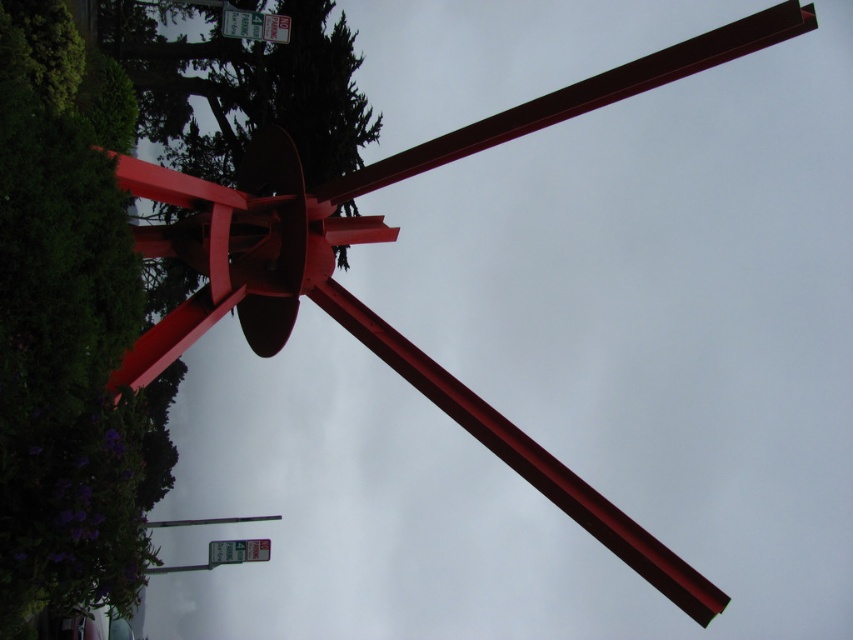
Question: Does white plastic sign at upper left have a larger size compared to metallic green street sign at lower center?

Choices:
 (A) no
 (B) yes

Answer: (B)

Question: Which point is closer to the camera taking this photo?

Choices:
 (A) (251, 541)
 (B) (109, 580)

Answer: (B)

Question: Is green leafy tree at upper left in front of white plastic sign at upper left?

Choices:
 (A) no
 (B) yes

Answer: (B)

Question: Which point is closer to the camera?

Choices:
 (A) green leafy tree at upper left
 (B) white plastic sign at upper left
 (C) metallic green street sign at lower center

Answer: (A)

Question: Based on their relative distances, which object is nearer to the white plastic sign at upper left?

Choices:
 (A) metallic green street sign at lower center
 (B) green leafy tree at upper left

Answer: (B)

Question: Is green leafy tree at upper left below white plastic sign at upper left?

Choices:
 (A) yes
 (B) no

Answer: (A)